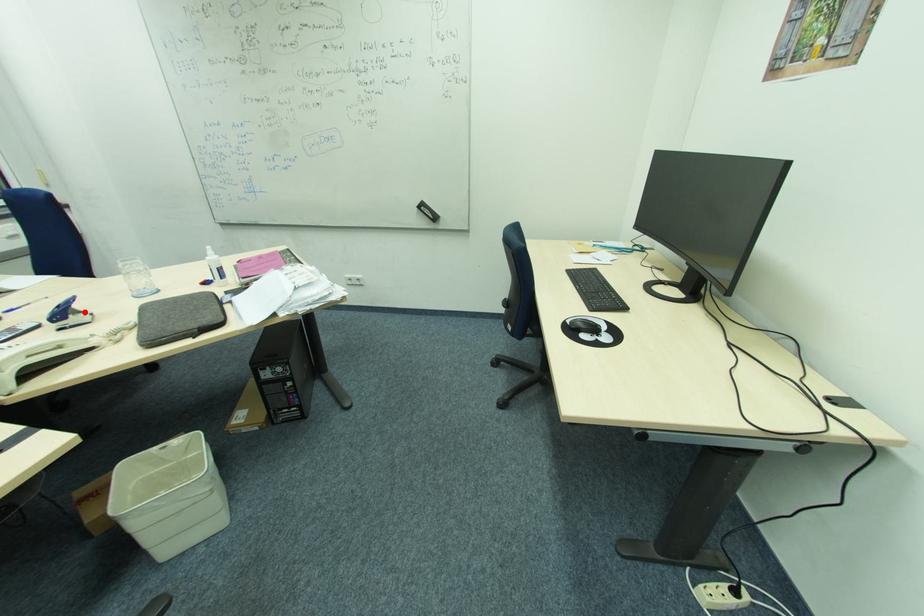
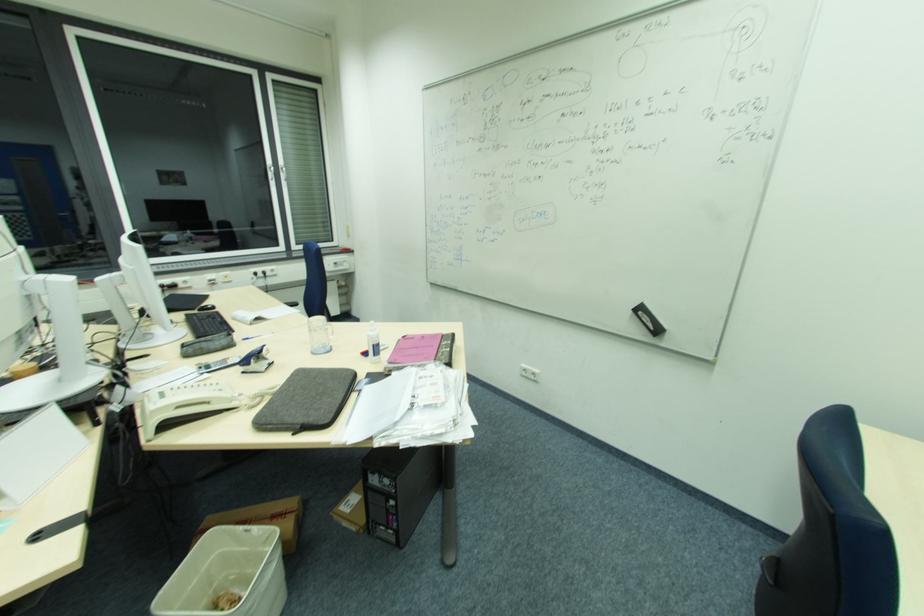
Find the pixel in the second image that matches the highlighted location in the first image.

(269, 359)